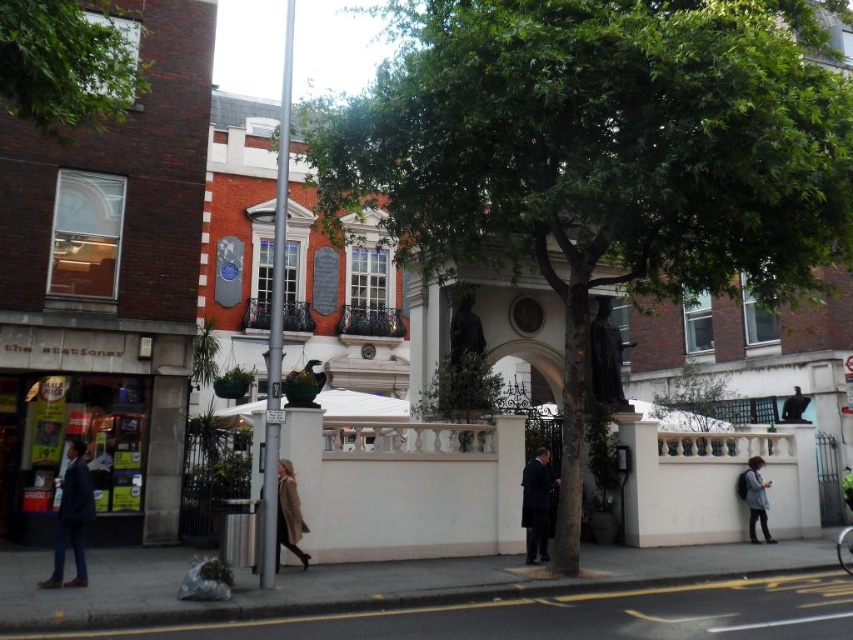
Which of these two, dark suit at center or dark gray backpack at lower right, stands shorter?

dark gray backpack at lower right

Is dark suit at center to the left of dark gray backpack at lower right from the viewer's perspective?

Indeed, dark suit at center is positioned on the left side of dark gray backpack at lower right.

This screenshot has height=640, width=853. In order to click on dark suit at center in this screenshot , I will do tap(537, 504).

This screenshot has height=640, width=853. What do you see at coordinates (288, 515) in the screenshot?
I see `brown wool coat at center` at bounding box center [288, 515].

In the scene shown: Is brown wool coat at center above dark blue suit at center?

Incorrect, brown wool coat at center is not positioned above dark blue suit at center.

The height and width of the screenshot is (640, 853). What do you see at coordinates (288, 515) in the screenshot?
I see `brown wool coat at center` at bounding box center [288, 515].

Locate an element on the screen. brown wool coat at center is located at coordinates (288, 515).

Does green leafy tree at upper left have a smaller size compared to brown wool coat at center?

Actually, green leafy tree at upper left might be larger than brown wool coat at center.

Looking at this image, does green leafy tree at upper left have a greater width compared to brown wool coat at center?

Indeed, green leafy tree at upper left has a greater width compared to brown wool coat at center.

Does point (70, 36) come closer to viewer compared to point (305, 563)?

Yes, it is.

Image resolution: width=853 pixels, height=640 pixels. Find the location of `green leafy tree at upper left`. green leafy tree at upper left is located at coordinates (67, 64).